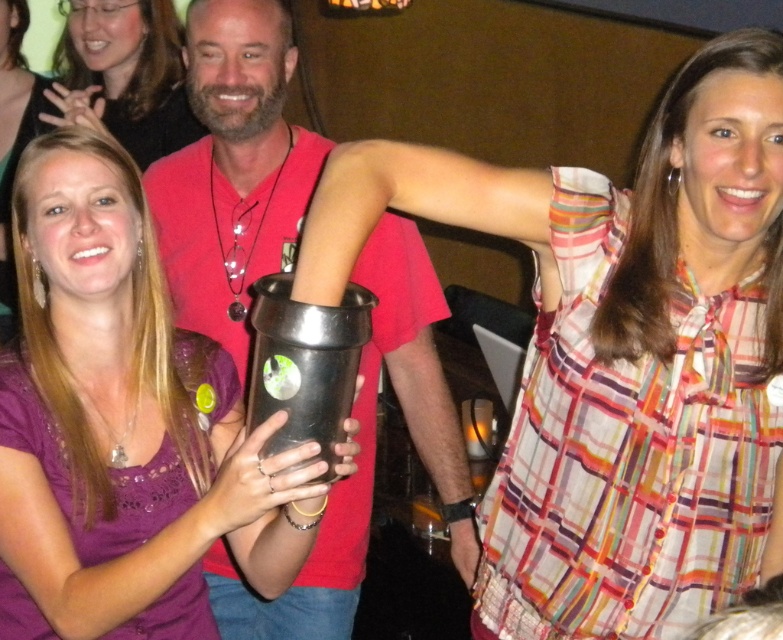
Question: Can you confirm if matte black cup at center is positioned above brushed metal shaker at center?

Choices:
 (A) yes
 (B) no

Answer: (B)

Question: Is matte black cup at center positioned at the back of black matte cup at center?

Choices:
 (A) yes
 (B) no

Answer: (A)

Question: Which of these objects is positioned farthest from the matte black cup at upper center?

Choices:
 (A) brushed metal shaker at center
 (B) matte black shaker at center

Answer: (B)

Question: Among these objects, which one is farthest from the camera?

Choices:
 (A) matte black shaker at center
 (B) black matte cup at center

Answer: (A)

Question: Does matte black shaker at center appear on the right side of brushed metal shaker at center?

Choices:
 (A) no
 (B) yes

Answer: (A)

Question: Which of the following is the farthest from the observer?

Choices:
 (A) matte black shaker at center
 (B) matte black cup at upper center
 (C) matte black cup at center

Answer: (B)